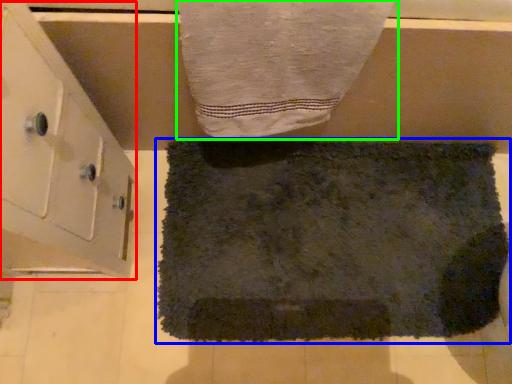
Question: Considering the real-world distances, which object is closest to cabinetry (highlighted by a red box)? towel (highlighted by a blue box) or towel (highlighted by a green box).

Choices:
 (A) towel
 (B) towel

Answer: (B)